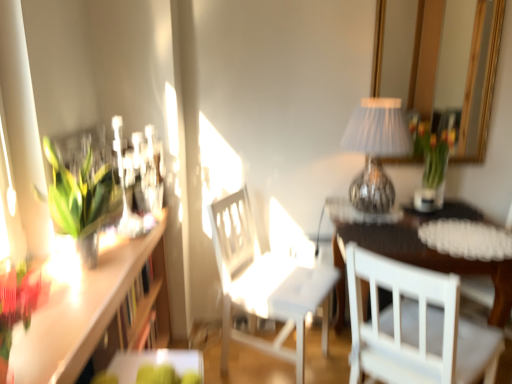
Question: Is green plastic tray at lower center, the first table positioned from the top, far from silver pleated lampshade at upper right?

Choices:
 (A) no
 (B) yes

Answer: (B)

Question: Is green plastic tray at lower center, which is counted as the 2th table, starting from the right, located outside silver pleated lampshade at upper right?

Choices:
 (A) no
 (B) yes

Answer: (B)

Question: Is the depth of green plastic tray at lower center, which ranks as the 2th table in bottom-to-top order, greater than that of silver pleated lampshade at upper right?

Choices:
 (A) yes
 (B) no

Answer: (B)

Question: Does green plastic tray at lower center, which ranks as the 2th table in bottom-to-top order, have a larger size compared to silver pleated lampshade at upper right?

Choices:
 (A) yes
 (B) no

Answer: (B)

Question: Considering the relative sizes of green plastic tray at lower center, which ranks as the 2th table in bottom-to-top order, and silver pleated lampshade at upper right in the image provided, is green plastic tray at lower center, which ranks as the 2th table in bottom-to-top order, shorter than silver pleated lampshade at upper right?

Choices:
 (A) yes
 (B) no

Answer: (A)

Question: From a real-world perspective, is silver pleated lampshade at upper right physically located above or below green leafy plant at left?

Choices:
 (A) below
 (B) above

Answer: (B)

Question: Does point (367, 175) appear closer or farther from the camera than point (74, 225)?

Choices:
 (A) closer
 (B) farther

Answer: (B)

Question: Relative to green leafy plant at left, is silver pleated lampshade at upper right in front or behind?

Choices:
 (A) behind
 (B) front

Answer: (A)

Question: Would you say silver pleated lampshade at upper right is inside or outside green leafy plant at left?

Choices:
 (A) outside
 (B) inside

Answer: (A)

Question: Would you say white matte chair at center, the 2th chair in the right-to-left sequence, is to the left or to the right of wooden table at center, positioned as the second table in front-to-back order, in the picture?

Choices:
 (A) right
 (B) left

Answer: (B)

Question: Looking at the image, does white matte chair at center, the 2th chair in the right-to-left sequence, seem bigger or smaller compared to wooden table at center, which is the first table in bottom-to-top order?

Choices:
 (A) big
 (B) small

Answer: (B)

Question: From the image's perspective, is white matte chair at center, the 2th chair in the right-to-left sequence, positioned above or below wooden table at center, which appears as the 1th table when viewed from the right?

Choices:
 (A) above
 (B) below

Answer: (A)

Question: Is white matte chair at center, the 2th chair in the right-to-left sequence, situated inside wooden table at center, which appears as the 1th table when viewed from the right, or outside?

Choices:
 (A) inside
 (B) outside

Answer: (B)

Question: In the image, is white wooden chair at lower right, acting as the 1th chair starting from the right, on the left side or the right side of translucent glass vase with tulips at upper right?

Choices:
 (A) left
 (B) right

Answer: (A)

Question: Is white wooden chair at lower right, the 2th chair viewed from the left, situated inside translucent glass vase with tulips at upper right or outside?

Choices:
 (A) outside
 (B) inside

Answer: (A)